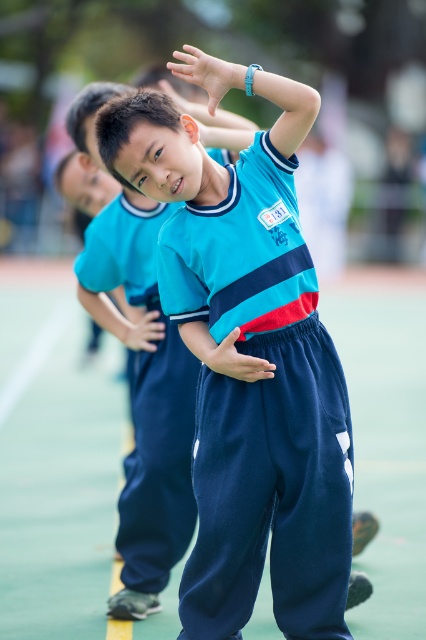
Question: Based on their relative distances, which object is nearer to the matte blue uniform at center?

Choices:
 (A) blue fabric uniform at center
 (B) matte blue hand at center
 (C) matte blue pants at center

Answer: (C)

Question: Does matte blue pants at center appear under matte blue hand at center?

Choices:
 (A) no
 (B) yes

Answer: (B)

Question: Which object appears farthest from the camera in this image?

Choices:
 (A) matte blue pants at center
 (B) matte blue hand at center
 (C) matte blue uniform at center
 (D) matte blue hand at upper center

Answer: (B)

Question: Can you confirm if matte blue hand at center is wider than matte blue hand at upper center?

Choices:
 (A) no
 (B) yes

Answer: (B)

Question: Can you confirm if blue fabric uniform at center is smaller than matte blue hand at upper center?

Choices:
 (A) no
 (B) yes

Answer: (A)

Question: Which of the following is the closest to the observer?

Choices:
 (A) (195, 509)
 (B) (227, 333)
 (C) (307, 470)

Answer: (B)